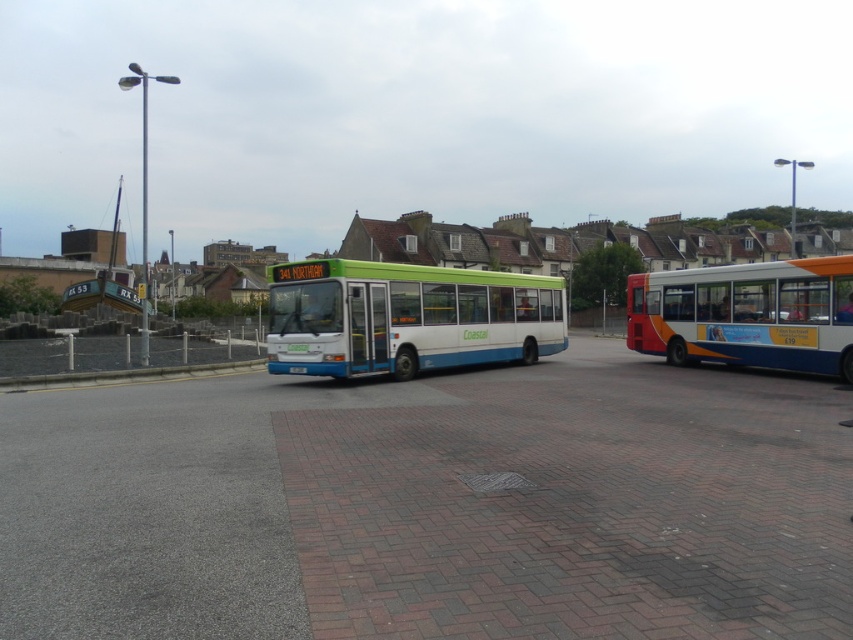
You are a pedestrian standing on the gray concrete curb at lower left, and you want to board the green matte bus at center. Is the bus accessible from your current position?

The green matte bus at center is positioned over the gray concrete curb at lower left, so yes, the bus is accessible from your current position on the gray concrete curb at lower left.

You are a delivery person trying to park your van between the green matte bus at center and the gray concrete curb at lower left. Can your van fit in the space between them if your van is 5 meters long?

The green matte bus at center is larger than the gray concrete curb at lower left, but the description does not provide specific measurements of the distance between them. Without knowing the exact space available, it is impossible to determine if the van will fit.

You are a delivery person needing to place a 2.5 meter long box between the gray concrete curb at lower left and the green plastic bus at center. Can the space accommodate the box?

The gray concrete curb at lower left has a lesser width compared to green plastic bus at center. However, the description does not provide the exact width measurements of either object, so it is impossible to determine if the space between them can fit a 2.5 meter long box.